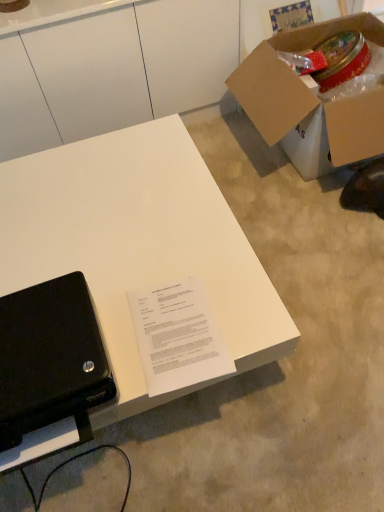
At what (x,y) coordinates should I click in order to perform the action: click on empty space that is to the right of black matte laptop at lower left. Please return your answer as a coordinate pair (x, y). The height and width of the screenshot is (512, 384). Looking at the image, I should click on (168, 331).